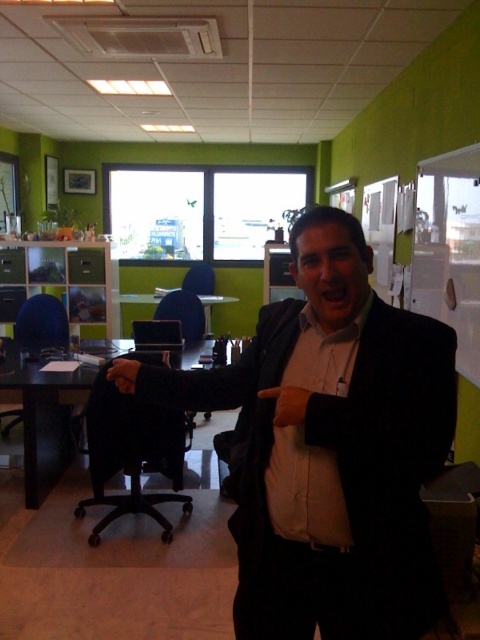
Is black plastic swivel chair at center taller than leather glove at center?

Yes, black plastic swivel chair at center is taller than leather glove at center.

Can you confirm if black plastic swivel chair at center is positioned to the left of leather glove at center?

Yes, black plastic swivel chair at center is to the left of leather glove at center.

Is point (129, 458) less distant than point (282, 400)?

No, (129, 458) is behind (282, 400).

This screenshot has height=640, width=480. Identify the location of black plastic swivel chair at center. (131, 452).

Can you confirm if black matte suit at center is positioned to the left of matte black hand at lower left?

Incorrect, black matte suit at center is not on the left side of matte black hand at lower left.

Can you confirm if black matte suit at center is bigger than matte black hand at lower left?

Correct, black matte suit at center is larger in size than matte black hand at lower left.

Describe the element at coordinates (333, 449) in the screenshot. Image resolution: width=480 pixels, height=640 pixels. I see `black matte suit at center` at that location.

I want to click on black matte suit at center, so click(333, 449).

Is black matte suit at center further to the viewer compared to leather glove at center?

No, black matte suit at center is in front of leather glove at center.

What are the coordinates of `black matte suit at center` in the screenshot? It's located at (333, 449).

Who is more distant from viewer, (265, 584) or (279, 422)?

The point (265, 584) is behind.

You are a GUI agent. You are given a task and a screenshot of the screen. Output one action in this format:
    pyautogui.click(x=<x>, y=<y>)
    Task: Click on the black matte suit at center
    The height and width of the screenshot is (640, 480).
    Given the screenshot: What is the action you would take?
    [333, 449]